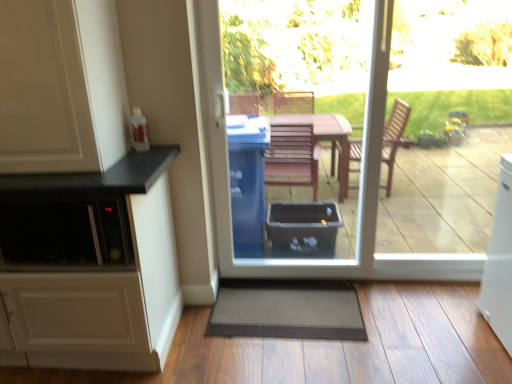
Where is `transparent plastic bin at center`? transparent plastic bin at center is located at coordinates (360, 179).

The image size is (512, 384). I want to click on white matte cabinet at left, marked as the 1th cabinetry in a bottom-to-top arrangement, so click(98, 270).

Where is `gray textured mat at lower center`? Image resolution: width=512 pixels, height=384 pixels. gray textured mat at lower center is located at coordinates (287, 310).

Where is `transparent plastic bin at center`? The height and width of the screenshot is (384, 512). transparent plastic bin at center is located at coordinates (360, 179).

Considering the sizes of white matte cabinet at left, marked as the 1th cabinetry in a bottom-to-top arrangement, and white matte cabinet at left, the 1th cabinetry positioned from the top, in the image, is white matte cabinet at left, marked as the 1th cabinetry in a bottom-to-top arrangement, wider or thinner than white matte cabinet at left, the 1th cabinetry positioned from the top,?

In the image, white matte cabinet at left, marked as the 1th cabinetry in a bottom-to-top arrangement, appears to be wider than white matte cabinet at left, the 1th cabinetry positioned from the top.

Is point (48, 254) farther from viewer compared to point (35, 132)?

Yes, it is.

From the image's perspective, is white matte cabinet at left, which appears as the 2th cabinetry when viewed from the top, located beneath white matte cabinet at left, the 1th cabinetry positioned from the top?

Indeed, from the image's perspective, white matte cabinet at left, which appears as the 2th cabinetry when viewed from the top, is shown beneath white matte cabinet at left, the 1th cabinetry positioned from the top.

Could you tell me if gray textured mat at lower center is turned towards white matte cabinet at left, which appears as the 2th cabinetry when viewed from the top?

No, gray textured mat at lower center is not aimed at white matte cabinet at left, which appears as the 2th cabinetry when viewed from the top.

Considering the sizes of objects gray textured mat at lower center and white matte cabinet at left, which appears as the 2th cabinetry when viewed from the top, in the image provided, who is bigger, gray textured mat at lower center or white matte cabinet at left, which appears as the 2th cabinetry when viewed from the top,?

Bigger between the two is white matte cabinet at left, which appears as the 2th cabinetry when viewed from the top.

Is gray textured mat at lower center placed right next to white matte cabinet at left, marked as the 1th cabinetry in a bottom-to-top arrangement?

They are not placed beside each other.

Which is more to the left, gray textured mat at lower center or white matte cabinet at left, which appears as the 2th cabinetry when viewed from the top?

white matte cabinet at left, which appears as the 2th cabinetry when viewed from the top.

Which object is closer to the camera, transparent plastic bin at center or white matte cabinet at left, marked as the 1th cabinetry in a bottom-to-top arrangement?

white matte cabinet at left, marked as the 1th cabinetry in a bottom-to-top arrangement, is more forward.

Is point (354, 276) more distant than point (89, 327)?

Yes, it is behind point (89, 327).

From the image's perspective, is transparent plastic bin at center above white matte cabinet at left, marked as the 1th cabinetry in a bottom-to-top arrangement?

Correct, transparent plastic bin at center appears higher than white matte cabinet at left, marked as the 1th cabinetry in a bottom-to-top arrangement, in the image.

Which of these two, transparent plastic bin at center or white matte cabinet at left, marked as the 1th cabinetry in a bottom-to-top arrangement, is bigger?

white matte cabinet at left, marked as the 1th cabinetry in a bottom-to-top arrangement.

Is white matte cabinet at left, the 1th cabinetry positioned from the top, spatially inside gray textured mat at lower center, or outside of it?

white matte cabinet at left, the 1th cabinetry positioned from the top, is not enclosed by gray textured mat at lower center.

Find the location of a particular element. The height and width of the screenshot is (384, 512). doormat below the white matte cabinet at left, the 1th cabinetry positioned from the top (from the image's perspective) is located at coordinates (287, 310).

Are white matte cabinet at left, marked as the second cabinetry in a bottom-to-top arrangement, and gray textured mat at lower center far apart?

white matte cabinet at left, marked as the second cabinetry in a bottom-to-top arrangement, is positioned a significant distance from gray textured mat at lower center.

Is white matte cabinet at left, marked as the second cabinetry in a bottom-to-top arrangement, oriented towards gray textured mat at lower center?

No, white matte cabinet at left, marked as the second cabinetry in a bottom-to-top arrangement, is not turned towards gray textured mat at lower center.

Would you say white matte cabinet at left, the 1th cabinetry positioned from the top, is inside or outside transparent plastic bin at center?

white matte cabinet at left, the 1th cabinetry positioned from the top, is not inside transparent plastic bin at center, it's outside.

You are a GUI agent. You are given a task and a screenshot of the screen. Output one action in this format:
    pyautogui.click(x=<x>, y=<y>)
    Task: Click on the door that is below the white matte cabinet at left, the 1th cabinetry positioned from the top (from the image's perspective)
    This screenshot has width=512, height=384.
    Given the screenshot: What is the action you would take?
    pyautogui.click(x=360, y=179)

Does white matte cabinet at left, the 1th cabinetry positioned from the top, lie in front of transparent plastic bin at center?

Yes, it is.

Considering the sizes of white matte cabinet at left, the 1th cabinetry positioned from the top, and transparent plastic bin at center in the image, is white matte cabinet at left, the 1th cabinetry positioned from the top, taller or shorter than transparent plastic bin at center?

Considering their sizes, white matte cabinet at left, the 1th cabinetry positioned from the top, has less height than transparent plastic bin at center.

Could you tell me if white matte cabinet at left, marked as the second cabinetry in a bottom-to-top arrangement, is turned towards white matte cabinet at left, which appears as the 2th cabinetry when viewed from the top?

No, white matte cabinet at left, marked as the second cabinetry in a bottom-to-top arrangement, is not facing towards white matte cabinet at left, which appears as the 2th cabinetry when viewed from the top.

Is white matte cabinet at left, marked as the second cabinetry in a bottom-to-top arrangement, bigger than white matte cabinet at left, marked as the 1th cabinetry in a bottom-to-top arrangement?

Incorrect, white matte cabinet at left, marked as the second cabinetry in a bottom-to-top arrangement, is not larger than white matte cabinet at left, marked as the 1th cabinetry in a bottom-to-top arrangement.

Is white matte cabinet at left, the 1th cabinetry positioned from the top, wider or thinner than white matte cabinet at left, marked as the 1th cabinetry in a bottom-to-top arrangement?

In the image, white matte cabinet at left, the 1th cabinetry positioned from the top, appears to be more narrow than white matte cabinet at left, marked as the 1th cabinetry in a bottom-to-top arrangement.

Between white matte cabinet at left, marked as the second cabinetry in a bottom-to-top arrangement, and white matte cabinet at left, marked as the 1th cabinetry in a bottom-to-top arrangement, which one is positioned in front?

white matte cabinet at left, marked as the second cabinetry in a bottom-to-top arrangement, is more forward.

Do you think gray textured mat at lower center is within white matte cabinet at left, the 1th cabinetry positioned from the top, or outside of it?

gray textured mat at lower center lies outside white matte cabinet at left, the 1th cabinetry positioned from the top.

Does gray textured mat at lower center turn towards white matte cabinet at left, the 1th cabinetry positioned from the top?

No, gray textured mat at lower center is not aimed at white matte cabinet at left, the 1th cabinetry positioned from the top.

Between gray textured mat at lower center and white matte cabinet at left, marked as the second cabinetry in a bottom-to-top arrangement, which one is positioned in front?

Positioned in front is white matte cabinet at left, marked as the second cabinetry in a bottom-to-top arrangement.

How much distance is there between gray textured mat at lower center and white matte cabinet at left, the 1th cabinetry positioned from the top?

gray textured mat at lower center and white matte cabinet at left, the 1th cabinetry positioned from the top, are 1.29 meters apart.

Find the location of a particular element. This screenshot has height=384, width=512. cabinetry below the white matte cabinet at left, marked as the second cabinetry in a bottom-to-top arrangement (from the image's perspective) is located at coordinates (98, 270).

What are the coordinates of `the 1st cabinetry in front of the gray textured mat at lower center, starting your count from the anchor` in the screenshot? It's located at (98, 270).

From the image, which object appears to be farther from white matte cabinet at left, marked as the 1th cabinetry in a bottom-to-top arrangement, white matte cabinet at left, the 1th cabinetry positioned from the top, or gray textured mat at lower center?

gray textured mat at lower center.

Considering their positions, is white matte cabinet at left, marked as the second cabinetry in a bottom-to-top arrangement, positioned closer to gray textured mat at lower center than white matte cabinet at left, marked as the 1th cabinetry in a bottom-to-top arrangement?

Among the two, white matte cabinet at left, marked as the 1th cabinetry in a bottom-to-top arrangement, is located nearer to gray textured mat at lower center.

Which object lies further to the anchor point gray textured mat at lower center, transparent plastic bin at center or white matte cabinet at left, which appears as the 2th cabinetry when viewed from the top?

white matte cabinet at left, which appears as the 2th cabinetry when viewed from the top, is positioned further to the anchor gray textured mat at lower center.

From the image, which object appears to be farther from white matte cabinet at left, the 1th cabinetry positioned from the top, gray textured mat at lower center or transparent plastic bin at center?

gray textured mat at lower center.

When comparing their distances from white matte cabinet at left, which appears as the 2th cabinetry when viewed from the top, does transparent plastic bin at center or gray textured mat at lower center seem closer?

gray textured mat at lower center.

Considering their positions, is white matte cabinet at left, marked as the second cabinetry in a bottom-to-top arrangement, positioned closer to transparent plastic bin at center than white matte cabinet at left, which appears as the 2th cabinetry when viewed from the top?

Among the two, white matte cabinet at left, which appears as the 2th cabinetry when viewed from the top, is located nearer to transparent plastic bin at center.

Estimate the real-world distances between objects in this image. Which object is further from white matte cabinet at left, which appears as the 2th cabinetry when viewed from the top, gray textured mat at lower center or white matte cabinet at left, marked as the second cabinetry in a bottom-to-top arrangement?

Among the two, gray textured mat at lower center is located further to white matte cabinet at left, which appears as the 2th cabinetry when viewed from the top.

From the image, which object appears to be nearer to transparent plastic bin at center, white matte cabinet at left, the 1th cabinetry positioned from the top, or gray textured mat at lower center?

Among the two, gray textured mat at lower center is located nearer to transparent plastic bin at center.

The image size is (512, 384). Find the location of `cabinetry between white matte cabinet at left, marked as the 1th cabinetry in a bottom-to-top arrangement, and transparent plastic bin at center from left to right`. cabinetry between white matte cabinet at left, marked as the 1th cabinetry in a bottom-to-top arrangement, and transparent plastic bin at center from left to right is located at coordinates (61, 86).

I want to click on cabinetry located between white matte cabinet at left, which appears as the 2th cabinetry when viewed from the top, and gray textured mat at lower center in the left-right direction, so click(61, 86).

Where is `doormat between white matte cabinet at left, marked as the second cabinetry in a bottom-to-top arrangement, and transparent plastic bin at center, in the horizontal direction`? The image size is (512, 384). doormat between white matte cabinet at left, marked as the second cabinetry in a bottom-to-top arrangement, and transparent plastic bin at center, in the horizontal direction is located at coordinates (287, 310).

I want to click on doormat situated between white matte cabinet at left, which appears as the 2th cabinetry when viewed from the top, and transparent plastic bin at center from left to right, so point(287,310).